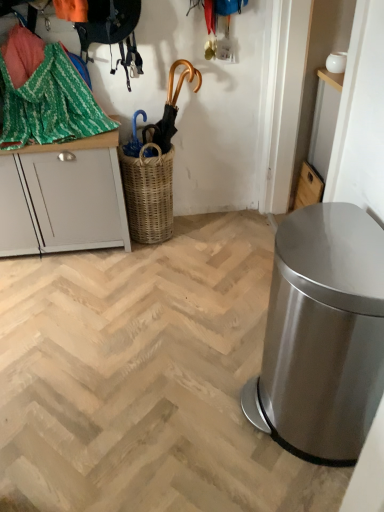
Question: Based on their sizes in the image, would you say gold metallic umbrella at upper center is bigger or smaller than satin silver trash can at right?

Choices:
 (A) small
 (B) big

Answer: (A)

Question: From the image's perspective, is gold metallic umbrella at upper center above or below satin silver trash can at right?

Choices:
 (A) above
 (B) below

Answer: (A)

Question: Which is nearer to the wooden cabinet at upper right, the 2th cabinetry in the left-to-right sequence?

Choices:
 (A) white painted wood cabinet at left, marked as the 2th cabinetry in a right-to-left arrangement
 (B) green woven fabric at upper left
 (C) woven brown basket at center
 (D) gold metallic umbrella at upper center
 (E) satin silver trash can at right

Answer: (D)

Question: Estimate the real-world distances between objects in this image. Which object is closer to the green woven fabric at upper left?

Choices:
 (A) white painted wood cabinet at left, marked as the 2th cabinetry in a right-to-left arrangement
 (B) woven brown basket at center
 (C) wooden cabinet at upper right, the 1th cabinetry in the right-to-left sequence
 (D) gold metallic umbrella at upper center
 (E) satin silver trash can at right

Answer: (A)